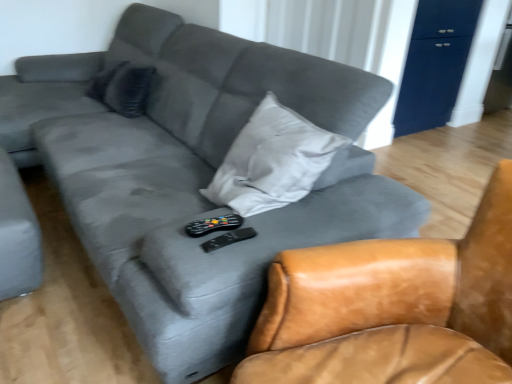
Question: Which direction should I rotate to look at black plastic remote at center, which is counted as the 2th remote, starting from the top, — up or down?

Choices:
 (A) up
 (B) down

Answer: (B)

Question: From a real-world perspective, does leather armchair at center stand above black plastic remote at center, which appears as the first remote when viewed from the top?

Choices:
 (A) yes
 (B) no

Answer: (B)

Question: Considering the relative positions of leather armchair at center and black plastic remote at center, acting as the second remote starting from the bottom, in the image provided, is leather armchair at center to the left of black plastic remote at center, acting as the second remote starting from the bottom, from the viewer's perspective?

Choices:
 (A) no
 (B) yes

Answer: (A)

Question: Is leather armchair at center positioned with its back to black plastic remote at center, acting as the second remote starting from the bottom?

Choices:
 (A) yes
 (B) no

Answer: (B)

Question: Does leather armchair at center have a larger size compared to black plastic remote at center, acting as the second remote starting from the bottom?

Choices:
 (A) yes
 (B) no

Answer: (A)

Question: Considering the relative sizes of leather armchair at center and black plastic remote at center, acting as the second remote starting from the bottom, in the image provided, is leather armchair at center thinner than black plastic remote at center, acting as the second remote starting from the bottom,?

Choices:
 (A) yes
 (B) no

Answer: (B)

Question: From the image's perspective, is leather armchair at center over black plastic remote at center, which appears as the first remote when viewed from the top?

Choices:
 (A) no
 (B) yes

Answer: (A)

Question: Is black plastic remote at center, acting as the second remote starting from the bottom, with black plastic remote at center, which is counted as the 2th remote, starting from the top?

Choices:
 (A) yes
 (B) no

Answer: (A)

Question: Does black plastic remote at center, which appears as the first remote when viewed from the top, appear on the left side of black plastic remote at center, which is counted as the 2th remote, starting from the top?

Choices:
 (A) yes
 (B) no

Answer: (A)

Question: From the image's perspective, is black plastic remote at center, which appears as the first remote when viewed from the top, below black plastic remote at center, which is counted as the 2th remote, starting from the top?

Choices:
 (A) yes
 (B) no

Answer: (B)

Question: Considering the relative sizes of black plastic remote at center, acting as the second remote starting from the bottom, and black plastic remote at center, which is counted as the 2th remote, starting from the top, in the image provided, is black plastic remote at center, acting as the second remote starting from the bottom, wider than black plastic remote at center, which is counted as the 2th remote, starting from the top,?

Choices:
 (A) yes
 (B) no

Answer: (A)

Question: Is black plastic remote at center, which appears as the first remote when viewed from the top, further to the viewer compared to black plastic remote at center, which is counted as the 2th remote, starting from the top?

Choices:
 (A) no
 (B) yes

Answer: (B)

Question: Can you confirm if black plastic remote at center, which appears as the first remote when viewed from the top, is shorter than black plastic remote at center, which is counted as the 2th remote, starting from the top?

Choices:
 (A) no
 (B) yes

Answer: (A)

Question: Can you confirm if black plastic remote at center, which is counted as the 2th remote, starting from the top, is smaller than matte dark blue dresser at upper right?

Choices:
 (A) no
 (B) yes

Answer: (B)